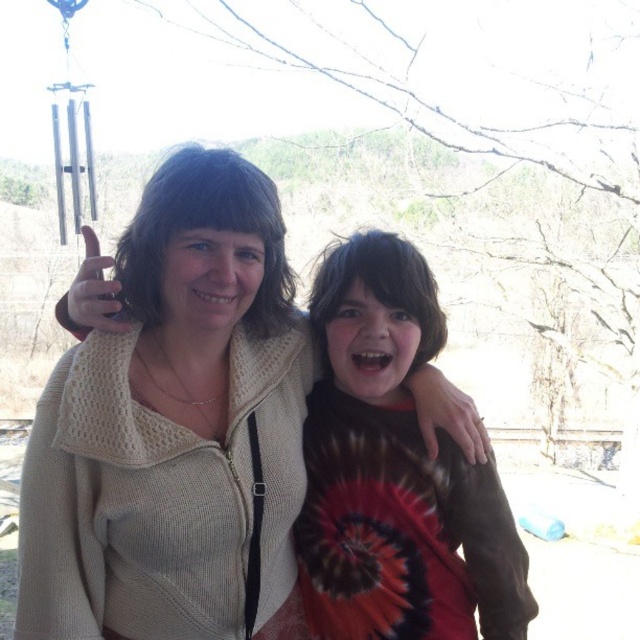
You are a photographer taking a picture of two people. You notice the matte brown hand at center and the matte skin hand at upper left in the frame. Which hand appears smaller in width?

The matte brown hand at center appears smaller in width than the matte skin hand at upper left because its width is less than the other.